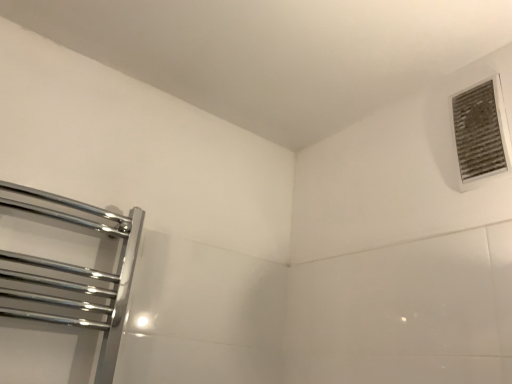
Where is `white textured vent at upper right`? The height and width of the screenshot is (384, 512). white textured vent at upper right is located at coordinates (481, 133).

What do you see at coordinates (481, 133) in the screenshot? I see `white textured vent at upper right` at bounding box center [481, 133].

What do you see at coordinates (68, 275) in the screenshot?
I see `chrome/metallic towel rack at left` at bounding box center [68, 275].

At what (x,y) coordinates should I click in order to perform the action: click on chrome/metallic towel rack at left. Please return your answer as a coordinate pair (x, y). Looking at the image, I should click on (68, 275).

Locate an element on the screen. white textured vent at upper right is located at coordinates (481, 133).

Is chrome/metallic towel rack at left to the left of white textured vent at upper right from the viewer's perspective?

Yes, chrome/metallic towel rack at left is to the left of white textured vent at upper right.

Which object is closer to the camera taking this photo, chrome/metallic towel rack at left or white textured vent at upper right?

chrome/metallic towel rack at left is closer to the camera.

Is point (103, 336) behind point (466, 124)?

That is False.

From the image's perspective, is chrome/metallic towel rack at left on white textured vent at upper right?

No, from the image's perspective, chrome/metallic towel rack at left is not above white textured vent at upper right.

Looking at this image, from a real-world perspective, is chrome/metallic towel rack at left beneath white textured vent at upper right?

Yes, from a real-world perspective, chrome/metallic towel rack at left is under white textured vent at upper right.

Considering the sizes of objects chrome/metallic towel rack at left and white textured vent at upper right in the image provided, who is thinner, chrome/metallic towel rack at left or white textured vent at upper right?

white textured vent at upper right.

Can you confirm if chrome/metallic towel rack at left is shorter than white textured vent at upper right?

No.

Considering the sizes of chrome/metallic towel rack at left and white textured vent at upper right in the image, is chrome/metallic towel rack at left bigger or smaller than white textured vent at upper right?

Considering their sizes, chrome/metallic towel rack at left takes up more space than white textured vent at upper right.

Consider the image. Is white textured vent at upper right completely or partially inside chrome/metallic towel rack at left?

No, white textured vent at upper right is located outside of chrome/metallic towel rack at left.

Is chrome/metallic towel rack at left not near white textured vent at upper right?

Yes.

From the picture: Is chrome/metallic towel rack at left turned away from white textured vent at upper right?

No.

Measure the distance between chrome/metallic towel rack at left and white textured vent at upper right.

They are 1.04 meters apart.

Locate an element on the screen. The height and width of the screenshot is (384, 512). air conditioning above the chrome/metallic towel rack at left (from the image's perspective) is located at coordinates (481, 133).

Based on their positions, is white textured vent at upper right located to the left or right of chrome/metallic towel rack at left?

From the image, it's evident that white textured vent at upper right is to the right of chrome/metallic towel rack at left.

Between white textured vent at upper right and chrome/metallic towel rack at left, which one is positioned behind?

Positioned behind is white textured vent at upper right.

Is point (499, 155) closer to viewer compared to point (118, 237)?

Yes, it is in front of point (118, 237).

From the image's perspective, between white textured vent at upper right and chrome/metallic towel rack at left, which one is located above?

white textured vent at upper right.

From the picture: From a real-world perspective, is white textured vent at upper right over chrome/metallic towel rack at left?

Yes.

Is white textured vent at upper right wider than chrome/metallic towel rack at left?

Incorrect, the width of white textured vent at upper right does not surpass that of chrome/metallic towel rack at left.

Considering the relative sizes of white textured vent at upper right and chrome/metallic towel rack at left in the image provided, is white textured vent at upper right shorter than chrome/metallic towel rack at left?

Yes, white textured vent at upper right is shorter than chrome/metallic towel rack at left.

In the scene shown: Is white textured vent at upper right bigger than chrome/metallic towel rack at left?

Incorrect, white textured vent at upper right is not larger than chrome/metallic towel rack at left.

Is white textured vent at upper right inside the boundaries of chrome/metallic towel rack at left, or outside?

A: white textured vent at upper right exists outside the volume of chrome/metallic towel rack at left.

Would you say white textured vent at upper right is a long distance from chrome/metallic towel rack at left?

Yes, white textured vent at upper right and chrome/metallic towel rack at left are located far from each other.

Is white textured vent at upper right turned away from chrome/metallic towel rack at left?

No, white textured vent at upper right's orientation is not away from chrome/metallic towel rack at left.

Locate an element on the screen. The width and height of the screenshot is (512, 384). air conditioning on the right of the chrome/metallic towel rack at left is located at coordinates (481, 133).

Image resolution: width=512 pixels, height=384 pixels. Identify the location of air conditioning above the chrome/metallic towel rack at left (from the image's perspective). (481, 133).

I want to click on air conditioning on the right of chrome/metallic towel rack at left, so click(x=481, y=133).